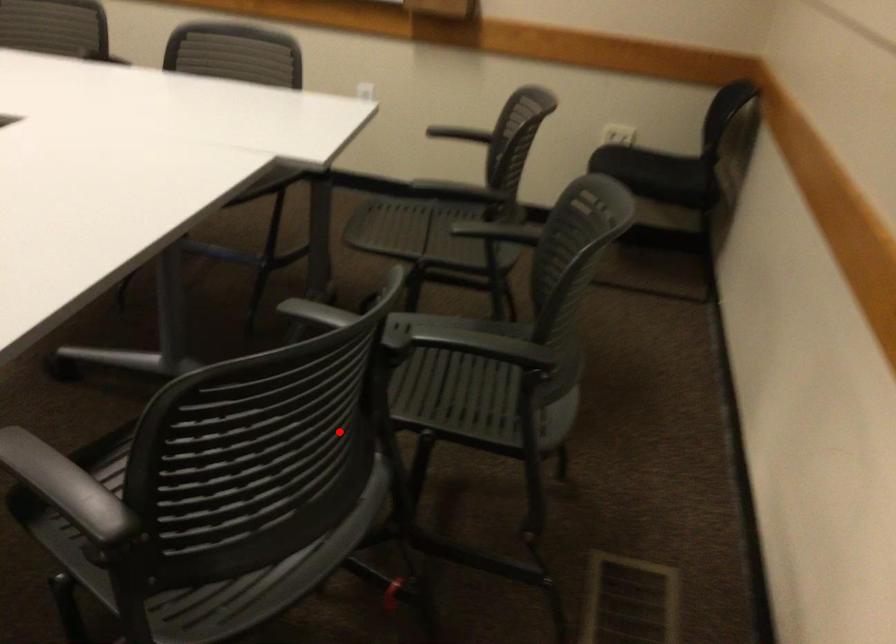
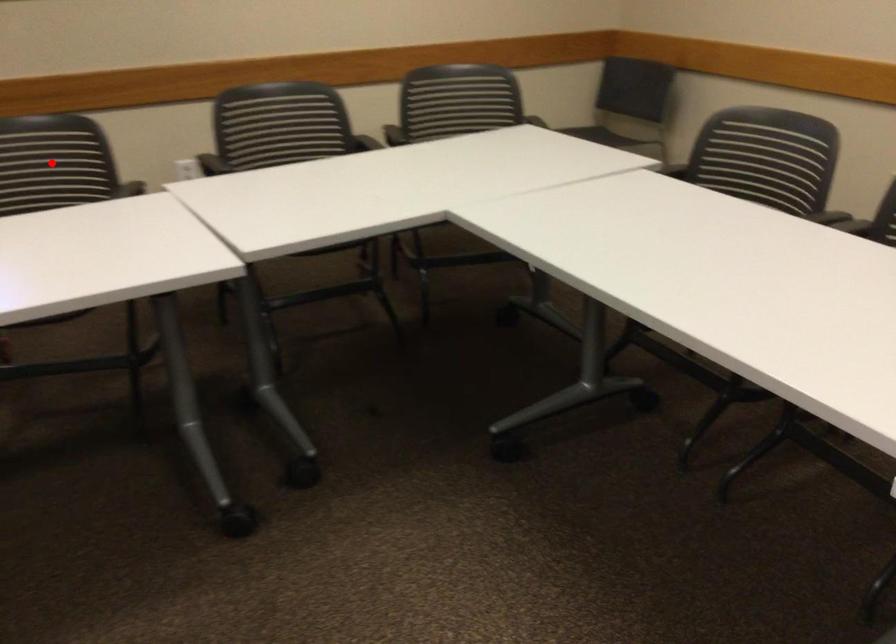
I am providing you with two images of the same scene from different viewpoints. A red point is marked on the first image and another point is marked on the second image. Does the point marked in image1 correspond to the same location as the one in image2?

Yes